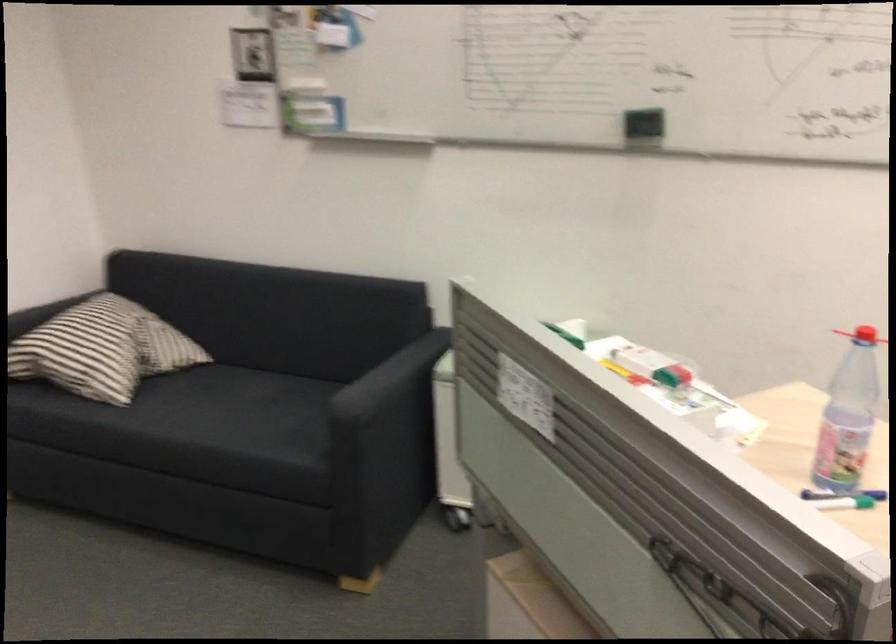
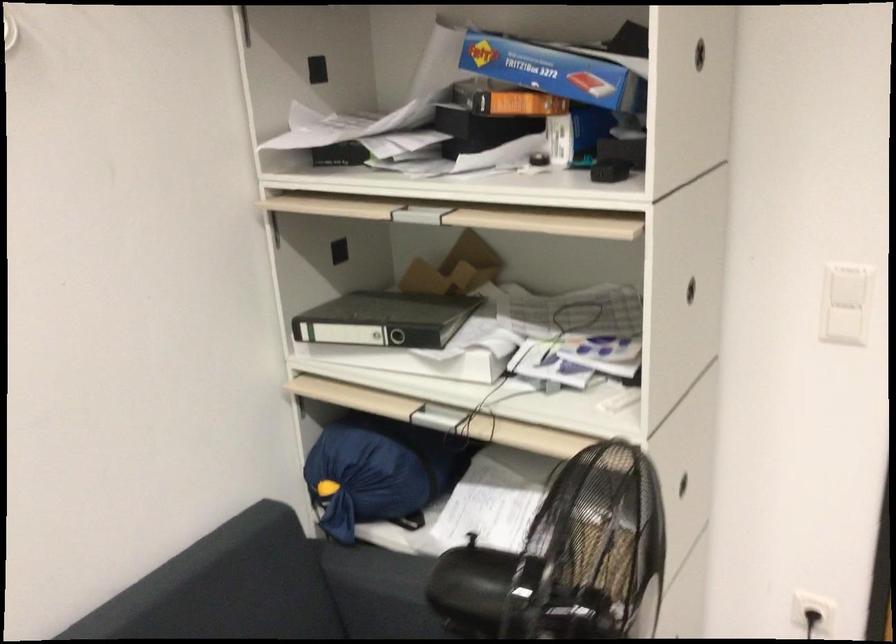
The images are taken continuously from a first-person perspective. In which direction is your viewpoint rotating?

The camera rotated toward left-down.